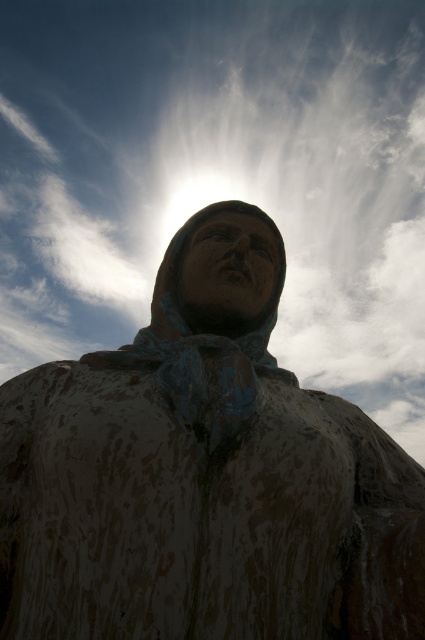
You are a photographer aiming to capture the statue without any obstructions. There is a white fluffy cloud at upper center at point [218,176]. Can you position yourself so that the statue is visible without the cloud blocking it?

The white fluffy cloud at upper center is located at point [218,176]. To avoid the cloud blocking the statue, move your position so that the statue is framed below or to the sides of the cloud.

From the picture: You are standing in front of the rusty metal statue at center and looking up. Which direction should you turn your head to see the white fluffy cloud at upper center?

The white fluffy cloud at upper center is to the right of the rusty metal statue at center, so you should turn your head to the right to see it.

You are an artist trying to sketch the scene. You notice the white fluffy cloud at upper center and the rusty metal statue at center. Which object in the scene is bigger?

The white fluffy cloud at upper center has a larger size compared to the rusty metal statue at center, so the white fluffy cloud at upper center is bigger.